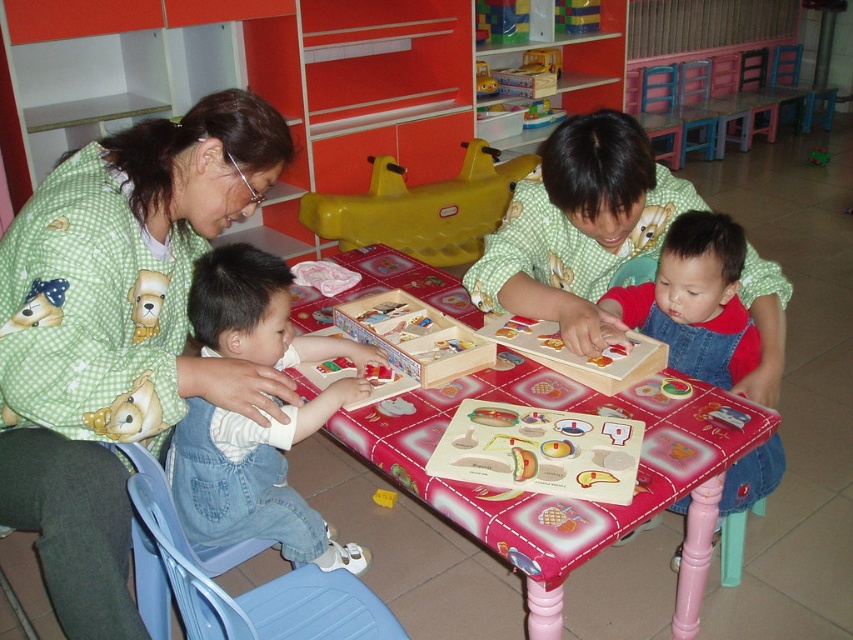
You are a child sitting at the table in the playroom. You want to hand a toy to the woman in the green checkered shirt at center and the child in denim overalls at lower left. Which person is closer to you?

The denim overalls at lower left is closer to you since it is positioned lower than the green checkered shirt at center, which is above it.

You are a child trying to decide which item to play with first. The denim overalls at lower right and the soft plush dog at left are both on the table. Which one takes up more space on the table?

The denim overalls at lower right is larger in size than the soft plush dog at left, so it takes up more space on the table.

Based on the photo, you are a parent trying to decide whether to place a new toy on the table between the denim overalls at lower right and the yellow plastic swing at center. Based on their heights, can the toy be placed there without being obscured?

The denim overalls at lower right is taller than the yellow plastic swing at center. Since the toy would be placed between them, its visibility might depend on the toy size. However, since the overalls are taller, it could potentially block the toy if placed near it. Consider positioning the toy closer to the swing to ensure it remains visible.